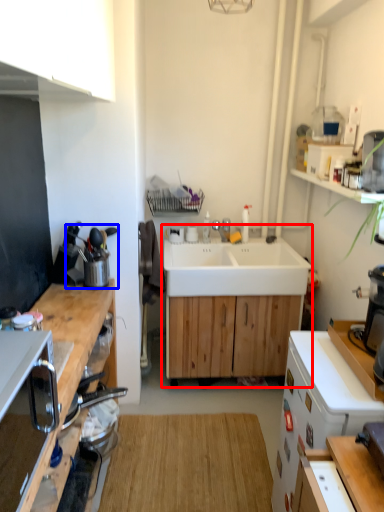
Question: Among these objects, which one is nearest to the camera, workbench (highlighted by a red box) or appliance (highlighted by a blue box)?

Choices:
 (A) workbench
 (B) appliance

Answer: (B)